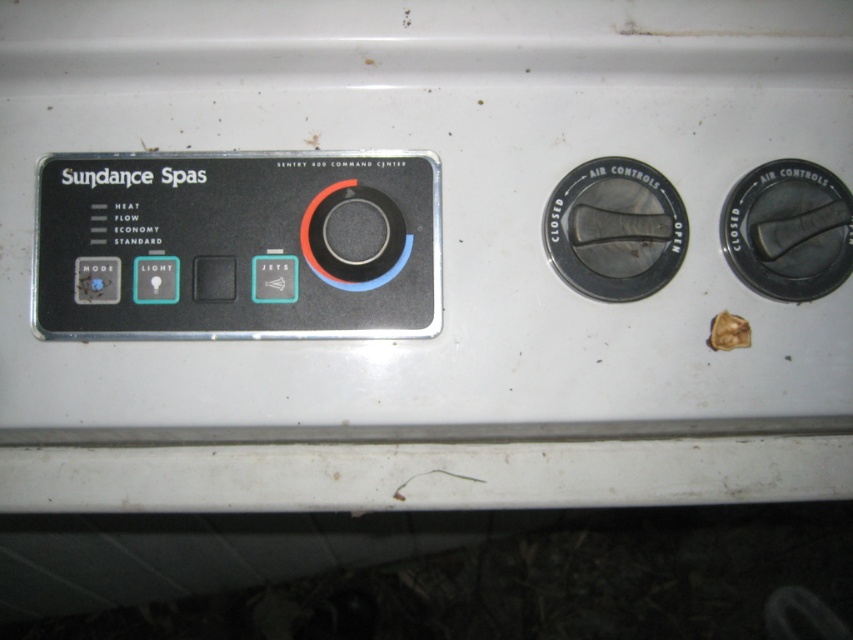
You are adjusting the settings on the Sundance Spas Sentry 400 Command Center control panel. You notice two controls on the right side of the panel. Which one is shorter in height between the black textured knob at right and the black plastic air control at right?

The black textured knob at right has a lesser height compared to the black plastic air control at right, so the black textured knob at right is shorter in height.

Looking at this image, you are adjusting the settings on the Sundance Spas Sentry 400 Command Center control panel. You notice two components near the center of the panel. Which component is thinner between the matte plastic light at center left and the matte plastic button at center?

The matte plastic light at center left is thinner than the matte plastic button at center.